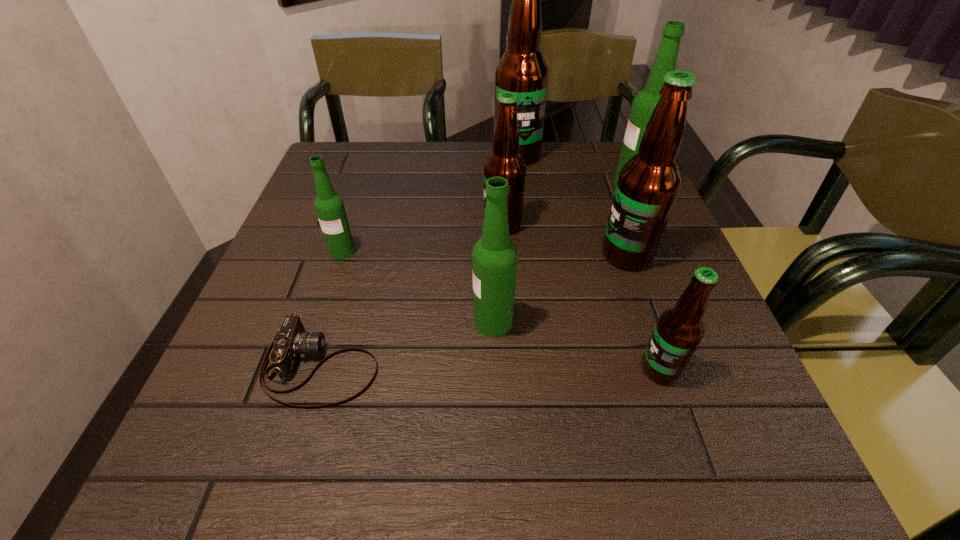
Choose which object is the fourth nearest neighbor to the third farthest brown beer bottle. Please provide its 2D coordinates. Your answer should be formatted as a tuple, i.e. [(x, y)], where the tuple contains the x and y coordinates of a point satisfying the conditions above.

[(494, 256)]

The image size is (960, 540). Identify the location of object that can be found as the seventh closest to the nearest brown beer bottle. (522, 69).

Identify which beer bottle is located as the second nearest to the leftmost beer bottle. Please provide its 2D coordinates. Your answer should be formatted as a tuple, i.e. [(x, y)], where the tuple contains the x and y coordinates of a point satisfying the conditions above.

[(494, 256)]

Where is `beer bottle that is the third nearest to the nearest brown beer bottle`? beer bottle that is the third nearest to the nearest brown beer bottle is located at coordinates (505, 161).

Image resolution: width=960 pixels, height=540 pixels. Identify the location of brown beer bottle that can be found as the fourth closest to the camera. (522, 69).

Find the location of a particular element. The image size is (960, 540). brown beer bottle that is the second closest one to the farthest green beer bottle is located at coordinates (522, 69).

At what (x,y) coordinates should I click in order to perform the action: click on green beer bottle identified as the second closest to the brown camera. Please return your answer as a coordinate pair (x, y). Looking at the image, I should click on (329, 206).

This screenshot has width=960, height=540. Find the location of `green beer bottle that stands as the closest to the brown camera`. green beer bottle that stands as the closest to the brown camera is located at coordinates (494, 256).

Where is `free space in the image that satisfies the following two spatial constraints: 1. on the label of the farthest object; 2. on the label of the sixth farthest beer bottle`? This screenshot has width=960, height=540. free space in the image that satisfies the following two spatial constraints: 1. on the label of the farthest object; 2. on the label of the sixth farthest beer bottle is located at coordinates (536, 322).